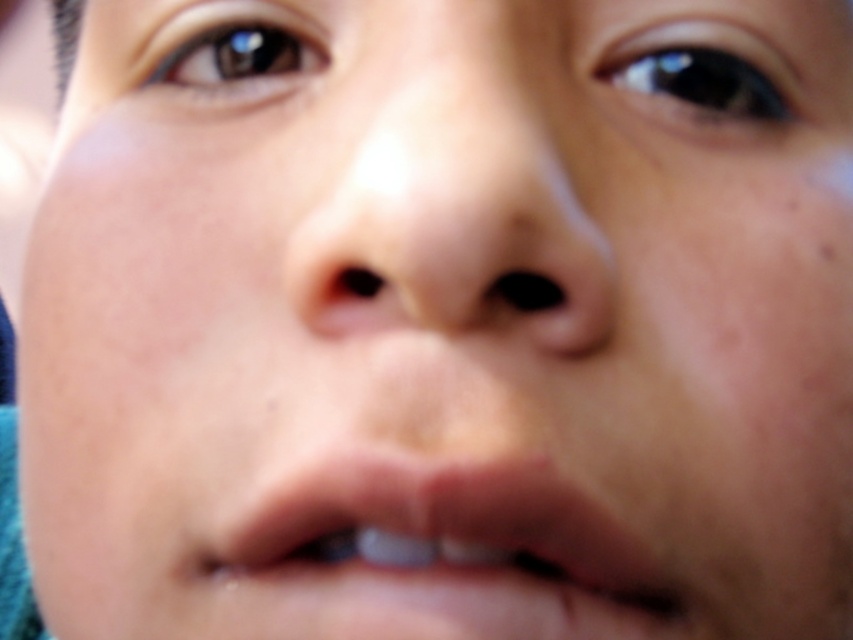
You are a photographer adjusting the focus on a camera. The subject has a smooth skin nose at center in the image. Where should you position the focus point to ensure the nose is in sharp focus?

The smooth skin nose at center is located at point (447,192), so you should position the focus point at those coordinates to ensure sharp focus on the nose.

You are taking a photo with a shallow depth of field. You want to focus on the point at point (424, 152) and point (297, 560). Which point is closer to the camera and will be in focus?

Point (424, 152) is closer to the viewer than point (297, 560), so it will be in focus while the other may be slightly blurred.